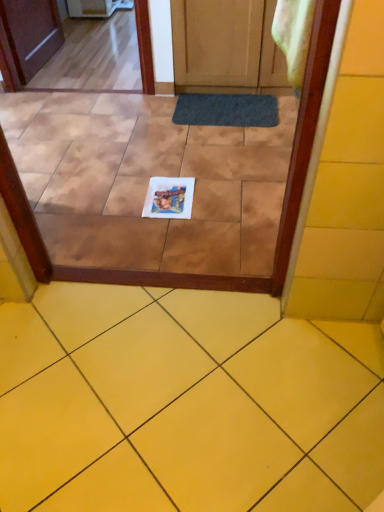
Locate an element on the screen. vacant space in front of dark gray rubber doormat at center is located at coordinates (224, 146).